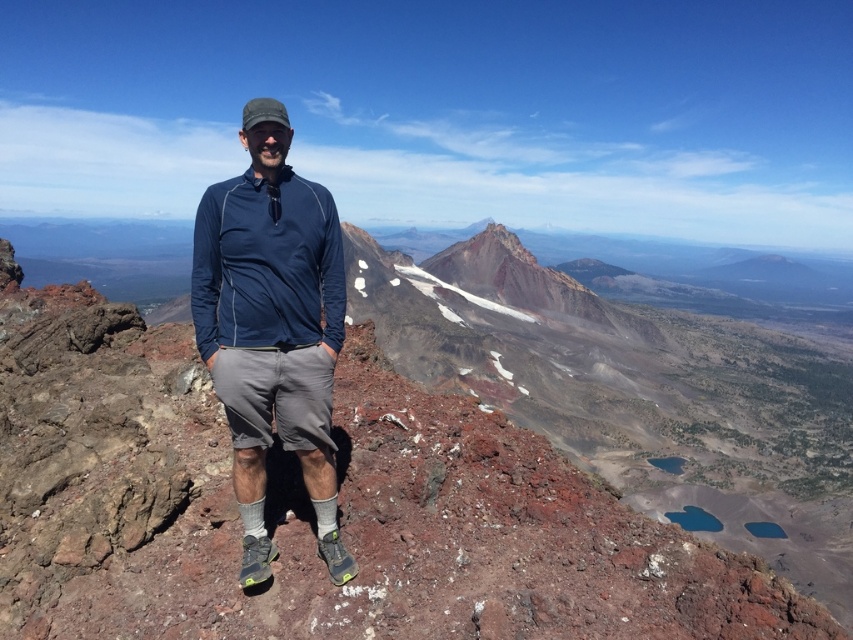
Question: Which point is farther to the camera?

Choices:
 (A) (238, 440)
 (B) (403, 298)

Answer: (B)

Question: Is rustic volcanic rock at center positioned behind navy blue fabric shirt at center?

Choices:
 (A) no
 (B) yes

Answer: (A)

Question: Is rustic volcanic rock at center positioned in front of navy blue fabric shirt at center?

Choices:
 (A) yes
 (B) no

Answer: (A)

Question: Which of the following is the closest to the observer?

Choices:
 (A) (229, 600)
 (B) (323, 417)

Answer: (A)

Question: Among these points, which one is farthest from the camera?

Choices:
 (A) (3, 371)
 (B) (308, 428)

Answer: (A)

Question: Does rustic volcanic rock at center have a lesser width compared to navy blue fabric shirt at center?

Choices:
 (A) yes
 (B) no

Answer: (B)